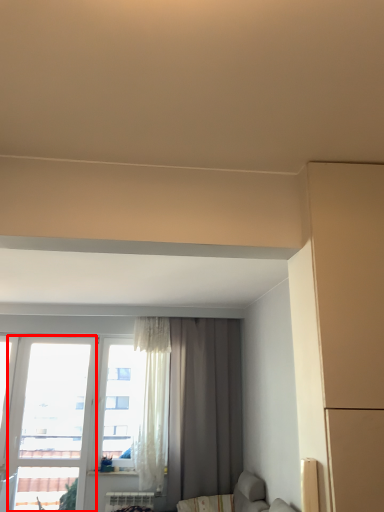
Question: Observing the image, what is the correct spatial positioning of window (annotated by the red box) in reference to curtain?

Choices:
 (A) left
 (B) right

Answer: (A)